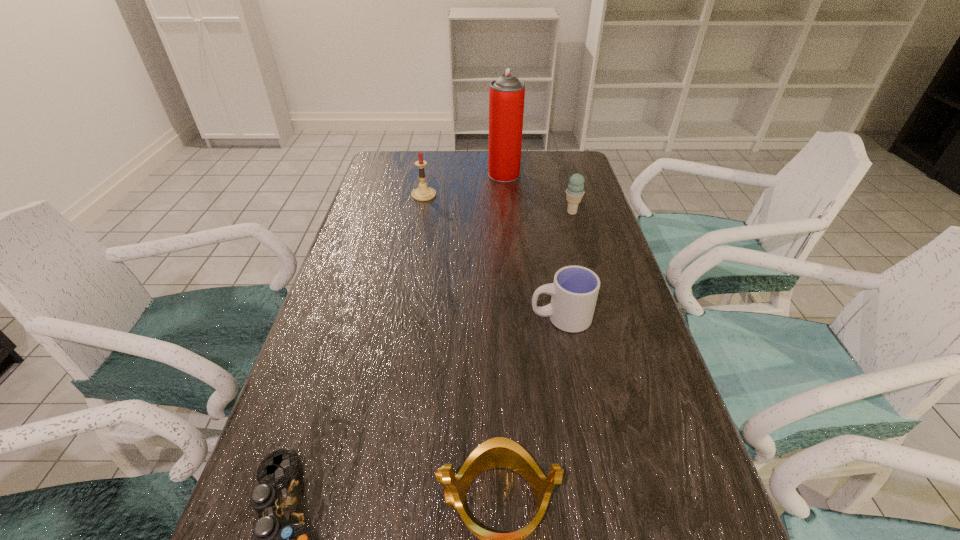
Where is `free space between the candle and the cup`? free space between the candle and the cup is located at coordinates (492, 256).

What are the coordinates of `free space between the fifth object from right to left and the fourth farthest object` in the screenshot? It's located at (492, 256).

The image size is (960, 540). I want to click on blank region between the ice cream and the aerosol can, so click(538, 193).

At what (x,y) coordinates should I click in order to perform the action: click on vacant region between the third nearest object and the farthest object. Please return your answer as a coordinate pair (x, y). The width and height of the screenshot is (960, 540). Looking at the image, I should click on (533, 246).

Find the location of `empty location between the cup and the tallest object`. empty location between the cup and the tallest object is located at coordinates (533, 246).

The image size is (960, 540). In order to click on empty space that is in between the fifth object from right to left and the cup in this screenshot , I will do `click(492, 256)`.

Identify which object is the fourth closest to the third nearest object. Please provide its 2D coordinates. Your answer should be formatted as a tuple, i.e. [(x, y)], where the tuple contains the x and y coordinates of a point satisfying the conditions above.

[(423, 193)]

Choose which object is the third nearest neighbor to the shortest object. Please provide its 2D coordinates. Your answer should be formatted as a tuple, i.e. [(x, y)], where the tuple contains the x and y coordinates of a point satisfying the conditions above.

[(423, 193)]